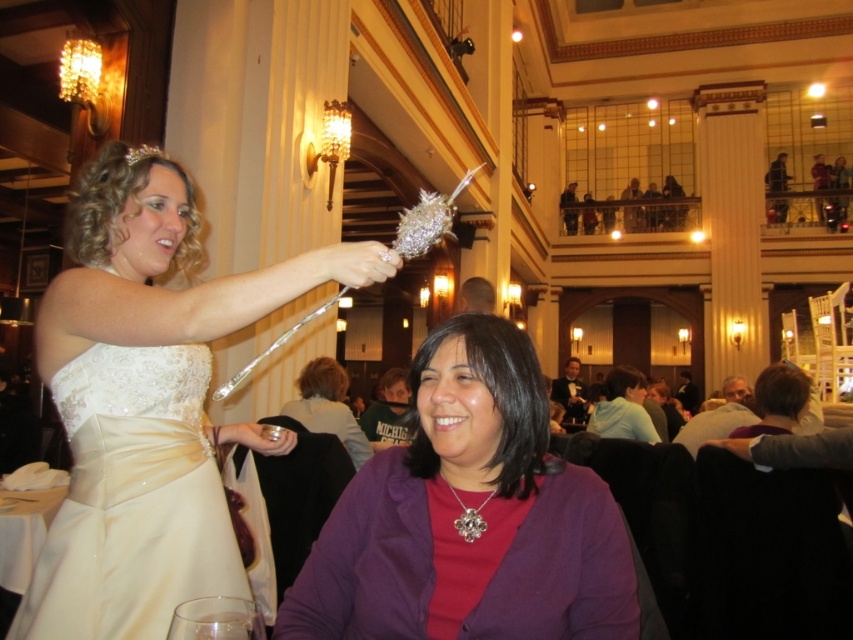
Question: Is purple fabric at center thinner than light blue hoodie at center?

Choices:
 (A) no
 (B) yes

Answer: (B)

Question: Is purple matte blazer at center positioned behind light blue hoodie at center?

Choices:
 (A) no
 (B) yes

Answer: (A)

Question: Which point is closer to the camera?

Choices:
 (A) pos(305,378)
 (B) pos(190,452)

Answer: (B)

Question: Based on their relative distances, which object is nearer to the ivory satin dress at upper left?

Choices:
 (A) matte white dress at center
 (B) purple matte blazer at center
 (C) light blue hoodie at center
 (D) purple fabric at center

Answer: (A)

Question: Which of the following is the closest to the observer?

Choices:
 (A) (74, 419)
 (B) (415, 582)
 (C) (628, 369)

Answer: (B)

Question: Is ivory satin dress at upper left above purple fabric at center?

Choices:
 (A) no
 (B) yes

Answer: (B)